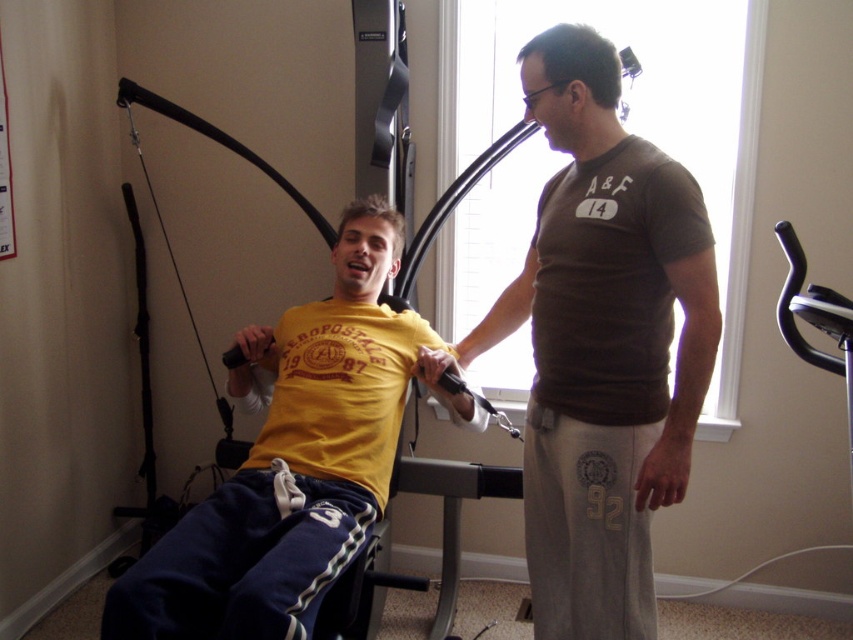
Is point (540, 60) in front of point (277, 614)?

No.

Which of these two, brown cotton t-shirt at center or yellow matte t-shirt at center, stands taller?

Standing taller between the two is brown cotton t-shirt at center.

Locate an element on the screen. This screenshot has width=853, height=640. brown cotton t-shirt at center is located at coordinates (602, 344).

You are a GUI agent. You are given a task and a screenshot of the screen. Output one action in this format:
    pyautogui.click(x=<x>, y=<y>)
    Task: Click on the brown cotton t-shirt at center
    Image resolution: width=853 pixels, height=640 pixels.
    Given the screenshot: What is the action you would take?
    pyautogui.click(x=602, y=344)